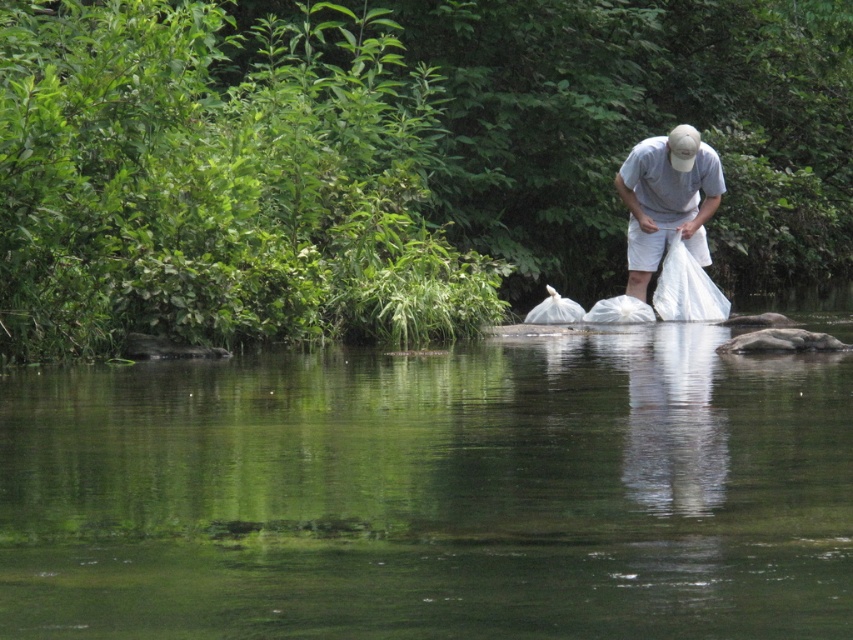
Between clear water at river center and white fabric bag at center, which one is positioned higher?

white fabric bag at center is above.

Does clear water at river center have a smaller size compared to white fabric bag at center?

No.

What do you see at coordinates (433, 493) in the screenshot?
I see `clear water at river center` at bounding box center [433, 493].

In order to click on clear water at river center in this screenshot , I will do `click(433, 493)`.